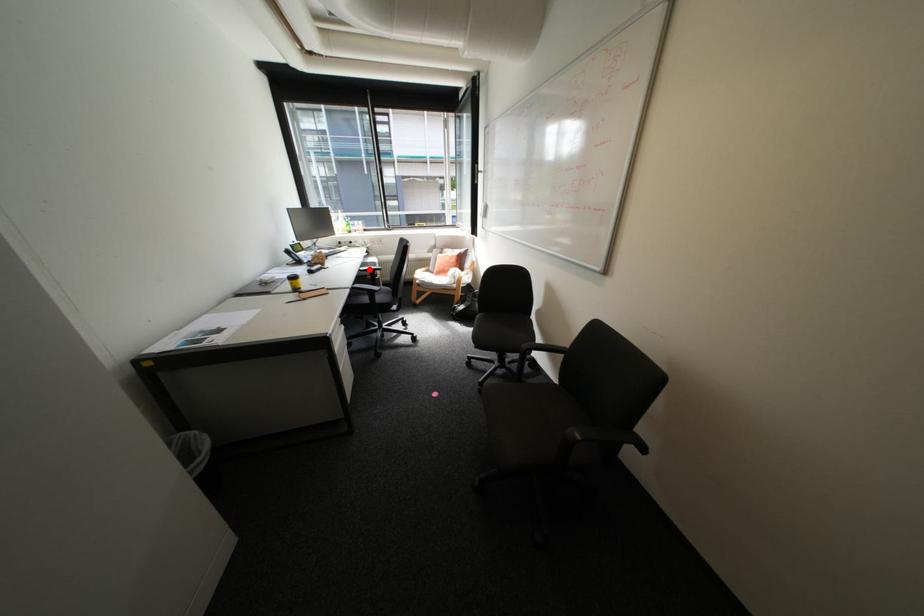
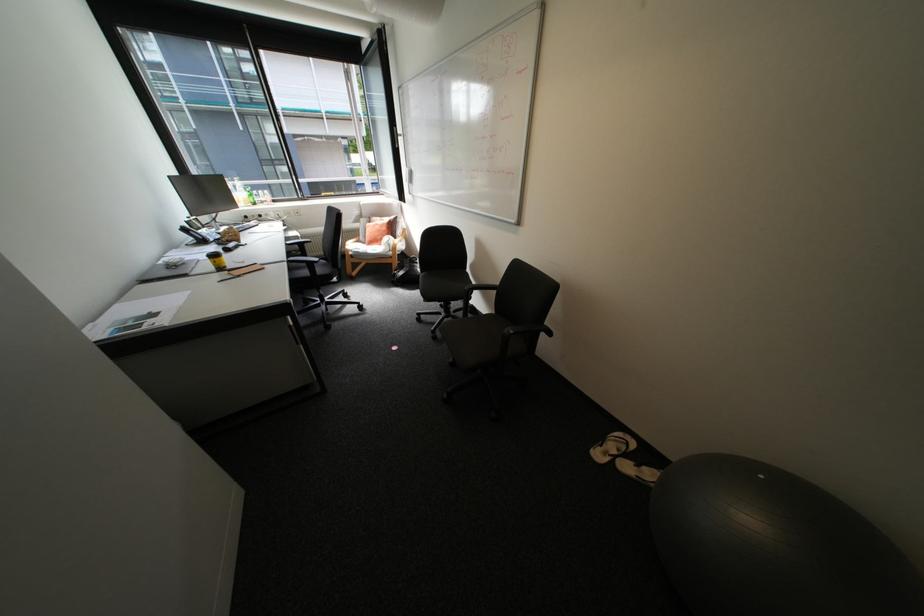
Locate, in the second image, the point that corresponds to the highlighted location in the first image.

(296, 244)